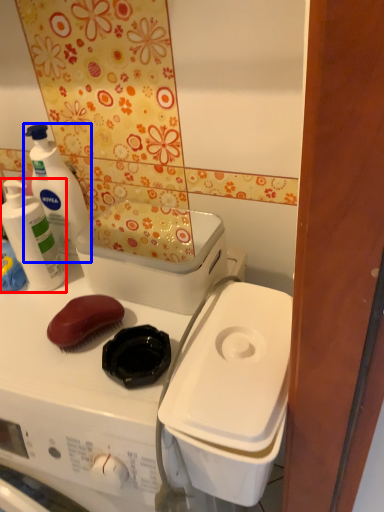
Question: Which of the following is the farthest to the observer, cleaning product (highlighted by a red box) or cleaning product (highlighted by a blue box)?

Choices:
 (A) cleaning product
 (B) cleaning product

Answer: (B)